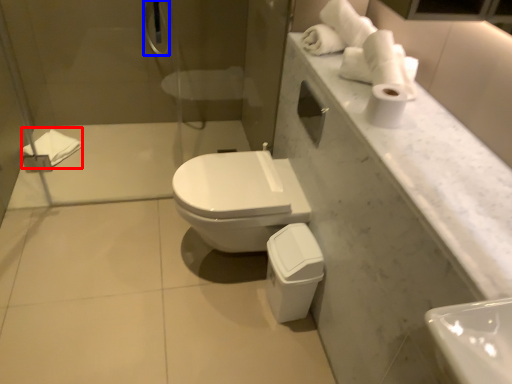
Question: Which object appears closest to the camera in this image, bath towel (highlighted by a red box) or shower (highlighted by a blue box)?

Choices:
 (A) bath towel
 (B) shower

Answer: (B)